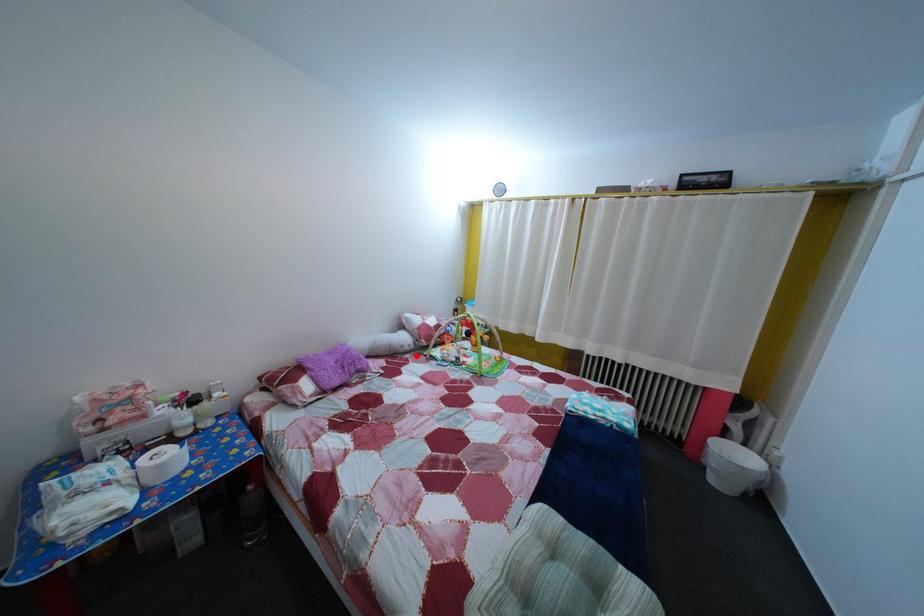
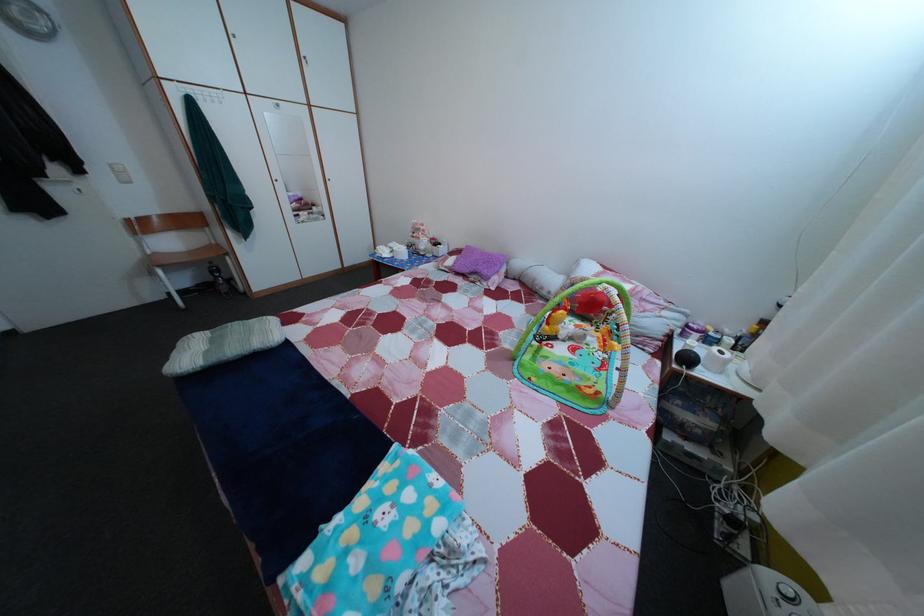
In the second image, find the point that corresponds to the highlighted location in the first image.

(553, 301)